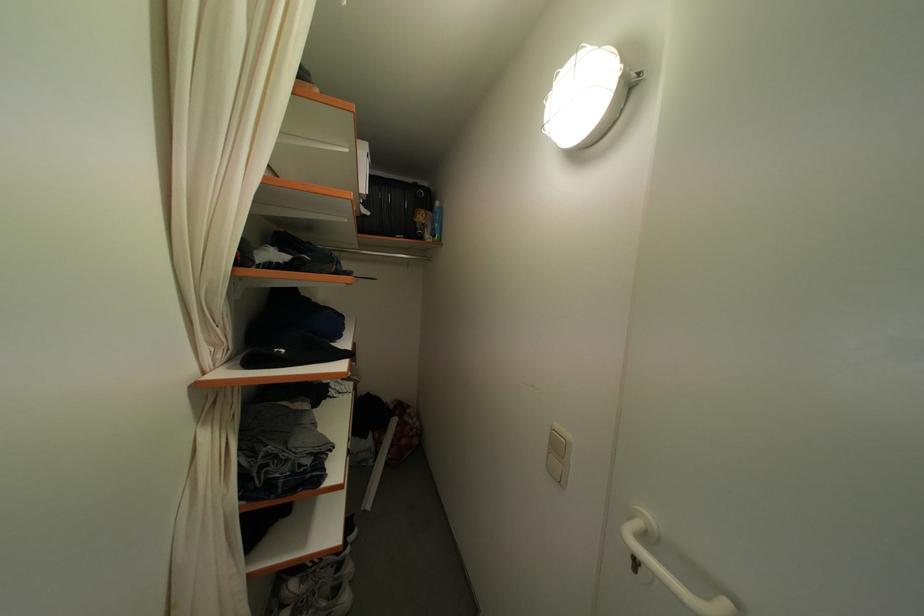
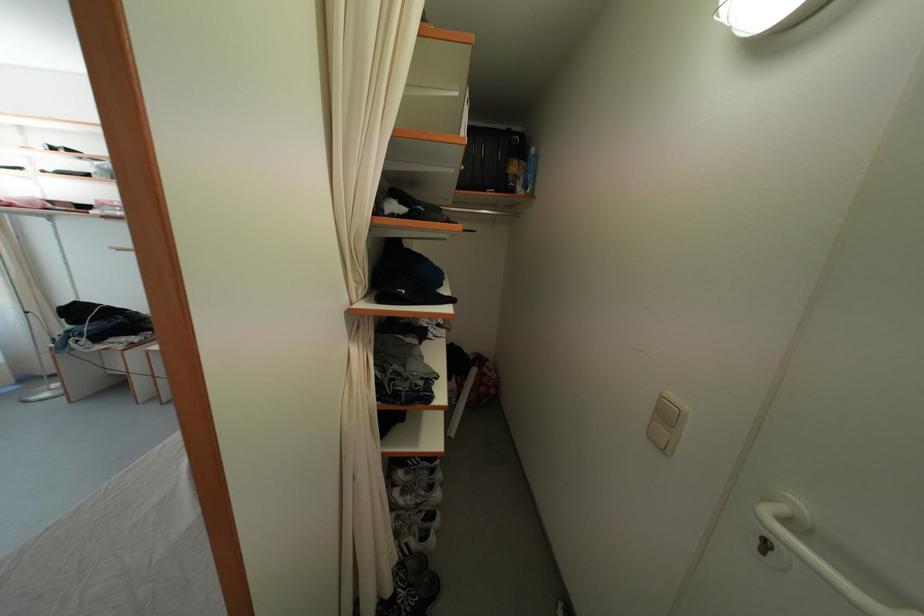
The point at [433,241] is marked in the first image. Where is the corresponding point in the second image?

(525, 195)